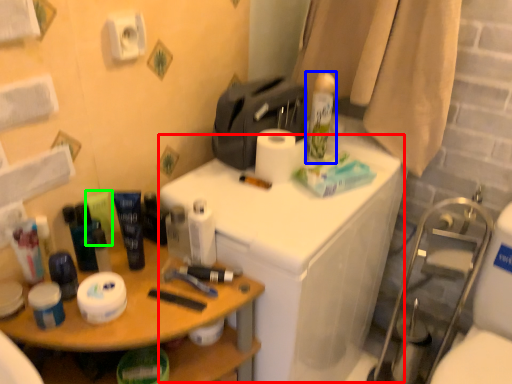
Question: Which object is the farthest from counter (highlighted by a red box)? Choose among these: shaving cream (highlighted by a blue box) or toiletry (highlighted by a green box).

Choices:
 (A) shaving cream
 (B) toiletry

Answer: (B)